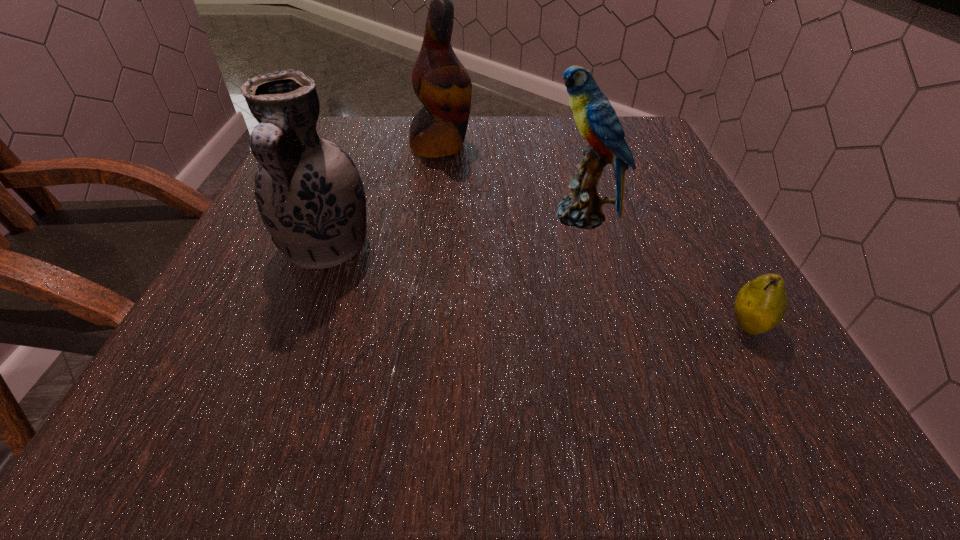
At what (x,y) coordinates should I click in order to perform the action: click on blank space that satisfies the following two spatial constraints: 1. on the face of the shorter parrot; 2. with the handle on the side of the vase. Please return your answer as a coordinate pair (x, y). Looking at the image, I should click on click(590, 248).

Find the location of a particular element. This screenshot has width=960, height=540. free spot that satisfies the following two spatial constraints: 1. on the face of the second object from left to right; 2. on the right side of the rightmost object is located at coordinates (419, 326).

Locate an element on the screen. vacant space that satisfies the following two spatial constraints: 1. with the handle on the side of the nearest object; 2. on the right side of the vase is located at coordinates (297, 326).

Where is `free space that satisfies the following two spatial constraints: 1. on the face of the nearest object; 2. on the right side of the third object from left to right`? This screenshot has width=960, height=540. free space that satisfies the following two spatial constraints: 1. on the face of the nearest object; 2. on the right side of the third object from left to right is located at coordinates pos(612,326).

At what (x,y) coordinates should I click in order to perform the action: click on vacant space that satisfies the following two spatial constraints: 1. on the face of the shortest object; 2. on the left side of the right parrot. Please return your answer as a coordinate pair (x, y). The height and width of the screenshot is (540, 960). Looking at the image, I should click on [612, 326].

At what (x,y) coordinates should I click in order to perform the action: click on vacant position in the image that satisfies the following two spatial constraints: 1. on the back side of the shortest object; 2. on the face of the farther parrot. Please return your answer as a coordinate pair (x, y). Looking at the image, I should click on (647, 146).